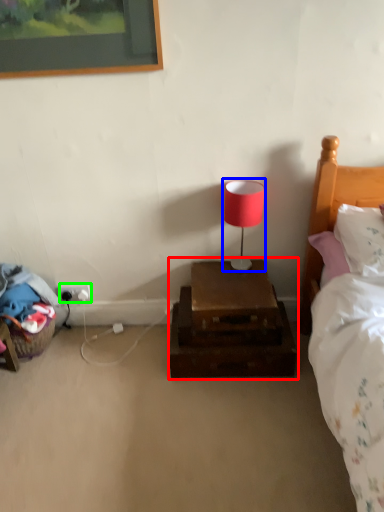
Question: Which object is the farthest from nightstand (highlighted by a red box)? Choose among these: table lamp (highlighted by a blue box) or electric outlet (highlighted by a green box).

Choices:
 (A) table lamp
 (B) electric outlet

Answer: (B)